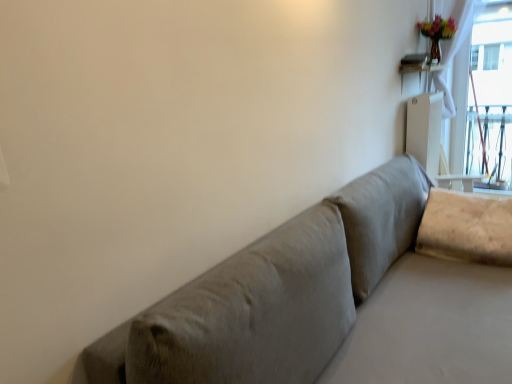
Question: From a real-world perspective, is white glossy table at upper right beneath beige fabric pillow at right?

Choices:
 (A) no
 (B) yes

Answer: (A)

Question: Considering the relative positions of white glossy table at upper right and beige fabric pillow at right in the image provided, is white glossy table at upper right to the left of beige fabric pillow at right from the viewer's perspective?

Choices:
 (A) no
 (B) yes

Answer: (A)

Question: Can you confirm if white glossy table at upper right is thinner than beige fabric pillow at right?

Choices:
 (A) no
 (B) yes

Answer: (B)

Question: Are white glossy table at upper right and beige fabric pillow at right far apart?

Choices:
 (A) yes
 (B) no

Answer: (A)

Question: Does white glossy table at upper right appear on the right side of beige fabric pillow at right?

Choices:
 (A) yes
 (B) no

Answer: (A)

Question: Is white glossy table at upper right further to the viewer compared to beige fabric pillow at right?

Choices:
 (A) yes
 (B) no

Answer: (A)

Question: Considering the relative sizes of beige fabric pillow at right and white glossy table at upper right in the image provided, is beige fabric pillow at right bigger than white glossy table at upper right?

Choices:
 (A) no
 (B) yes

Answer: (B)

Question: Can you confirm if beige fabric pillow at right is shorter than white glossy table at upper right?

Choices:
 (A) no
 (B) yes

Answer: (A)

Question: Is beige fabric pillow at right to the left of white glossy table at upper right from the viewer's perspective?

Choices:
 (A) yes
 (B) no

Answer: (A)

Question: Is beige fabric pillow at right not close to white glossy table at upper right?

Choices:
 (A) yes
 (B) no

Answer: (A)

Question: Is beige fabric pillow at right to the right of white glossy table at upper right from the viewer's perspective?

Choices:
 (A) yes
 (B) no

Answer: (B)

Question: Is beige fabric pillow at right behind white glossy table at upper right?

Choices:
 (A) yes
 (B) no

Answer: (B)

Question: Does point (406, 66) appear closer or farther from the camera than point (490, 215)?

Choices:
 (A) farther
 (B) closer

Answer: (A)